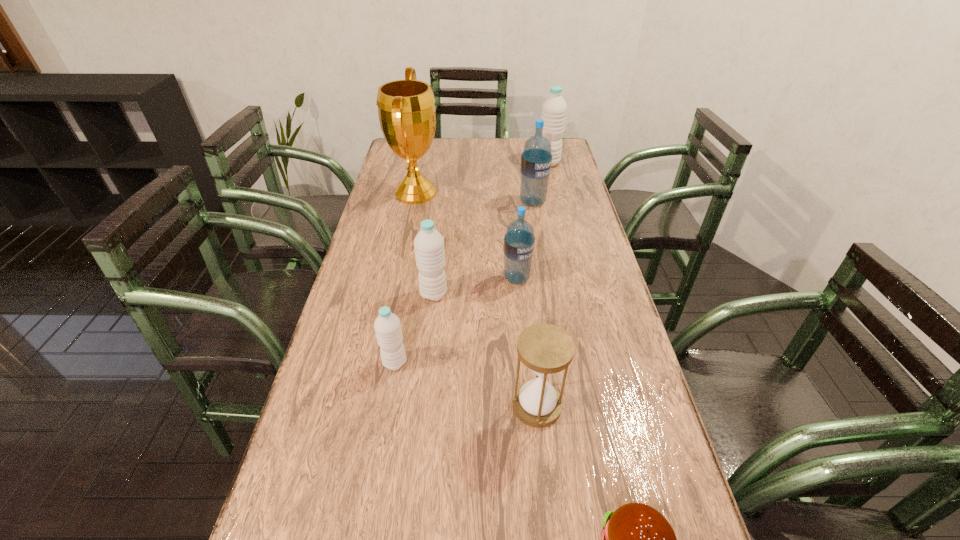
Find the location of a particular element. This screenshot has height=540, width=960. object located at the far edge is located at coordinates (554, 109).

Locate an element on the screen. This screenshot has height=540, width=960. award at the left edge is located at coordinates click(x=406, y=109).

At what (x,y) coordinates should I click in order to perform the action: click on water bottle that is at the left edge. Please return your answer as a coordinate pair (x, y). The width and height of the screenshot is (960, 540). Looking at the image, I should click on (387, 326).

Where is `object positioned at the far right corner`? object positioned at the far right corner is located at coordinates (554, 109).

Find the location of a particular element. blank area at the far edge is located at coordinates (503, 150).

Where is `vacant space at the left edge of the desktop`? vacant space at the left edge of the desktop is located at coordinates (369, 217).

Locate an element on the screen. This screenshot has height=540, width=960. vacant region at the right edge is located at coordinates (570, 224).

Locate an element on the screen. vacant space at the far right corner of the desktop is located at coordinates (563, 141).

Image resolution: width=960 pixels, height=540 pixels. I want to click on free space between the white hourglass and the fourth water bottle from right to left, so click(486, 349).

At what (x,y) coordinates should I click in order to perform the action: click on free space between the biggest white water bottle and the white hourglass. Please return your answer as a coordinate pair (x, y). This screenshot has width=960, height=540. Looking at the image, I should click on (542, 284).